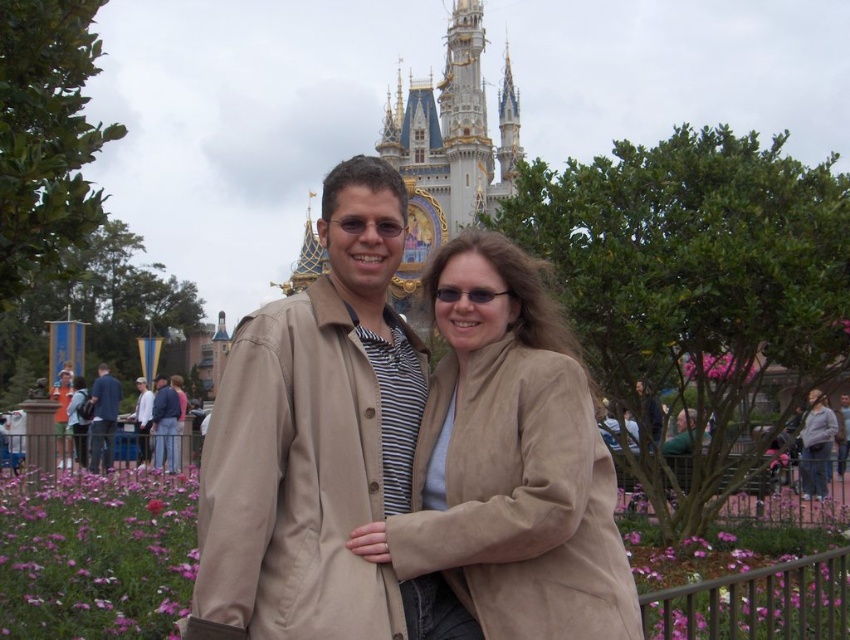
Who is higher up, tan fabric coat at center or white cotton shirt at center?

tan fabric coat at center is above.

Which is in front, point (304, 324) or point (145, 422)?

Point (304, 324) is more forward.

In order to click on tan fabric coat at center in this screenshot , I will do `click(315, 440)`.

Does tan fabric coat at center appear on the right side of blue denim jeans at center?

Indeed, tan fabric coat at center is positioned on the right side of blue denim jeans at center.

This screenshot has height=640, width=850. I want to click on tan fabric coat at center, so tap(315, 440).

Does point (262, 356) come closer to viewer compared to point (159, 445)?

That is True.

Find the location of a particular element. tan fabric coat at center is located at coordinates (315, 440).

Is suede coat at center further to the viewer compared to white cotton shirt at center?

No, it is in front of white cotton shirt at center.

Does suede coat at center appear on the left side of white cotton shirt at center?

In fact, suede coat at center is to the right of white cotton shirt at center.

Is point (411, 572) positioned behind point (142, 381)?

No.

Image resolution: width=850 pixels, height=640 pixels. What are the coordinates of `suede coat at center` in the screenshot? It's located at (510, 461).